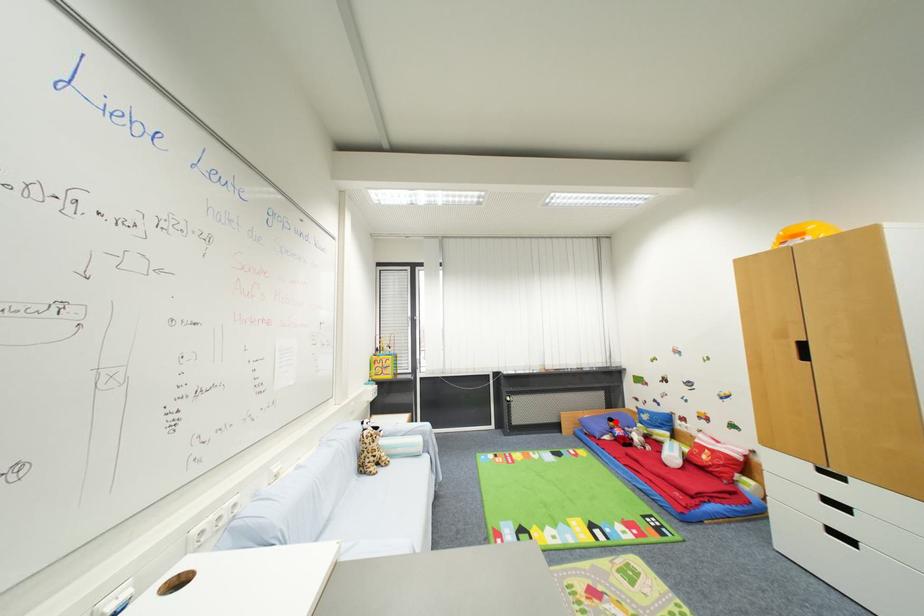
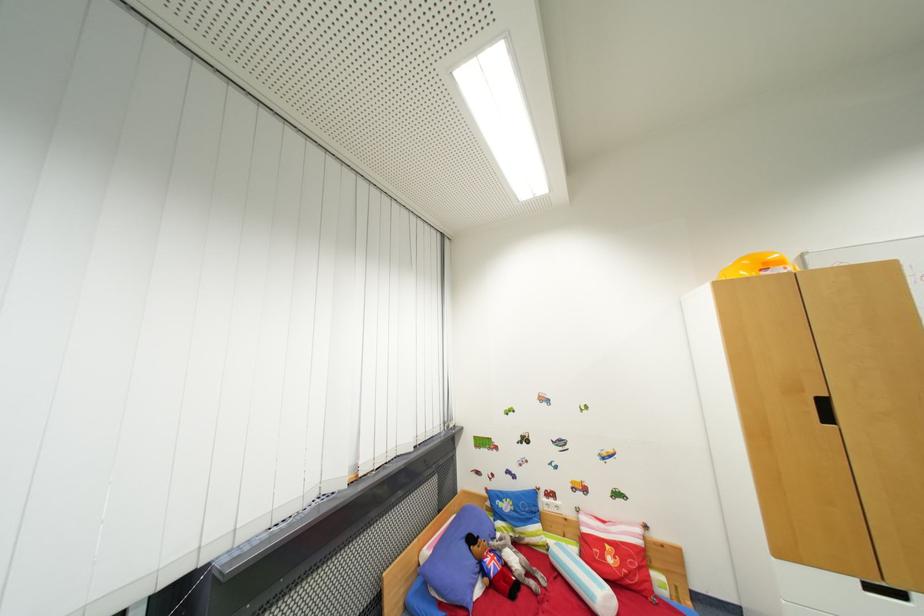
Question: I am providing you with two images of the same scene from different viewpoints. Image1 has a red point marked. In image2, the corresponding 3D location appears at what relative position? Reply with the corresponding letter.

Choices:
 (A) Closer
 (B) Farther

Answer: (A)